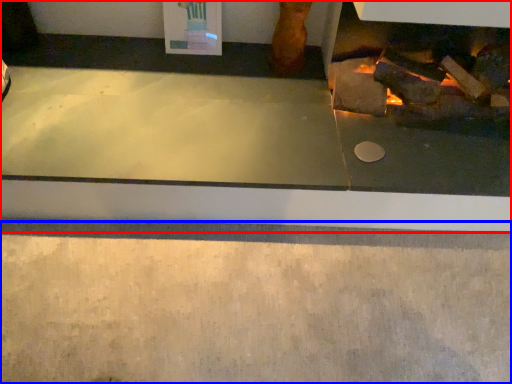
Question: Which object is further to the camera taking this photo, fireplace (highlighted by a red box) or concrete (highlighted by a blue box)?

Choices:
 (A) fireplace
 (B) concrete

Answer: (A)